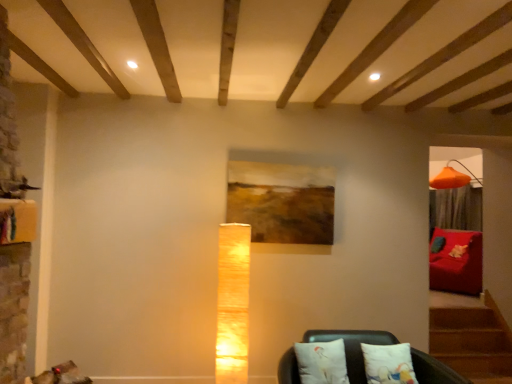
Question: From a real-world perspective, is white fabric cushions at lower center, marked as the first furniture in a front-to-back arrangement, physically below wooden painting at center?

Choices:
 (A) no
 (B) yes

Answer: (B)

Question: Is white fabric cushions at lower center, which ranks as the 2th furniture in right-to-left order, looking in the opposite direction of wooden painting at center?

Choices:
 (A) no
 (B) yes

Answer: (A)

Question: From the image's perspective, is white fabric cushions at lower center, marked as the first furniture in a front-to-back arrangement, under wooden painting at center?

Choices:
 (A) no
 (B) yes

Answer: (B)

Question: From the image's perspective, does white fabric cushions at lower center, the second furniture when ordered from back to front, appear higher than wooden painting at center?

Choices:
 (A) yes
 (B) no

Answer: (B)

Question: Does white fabric cushions at lower center, which is the first furniture in left-to-right order, have a greater width compared to wooden painting at center?

Choices:
 (A) no
 (B) yes

Answer: (B)

Question: From the image's perspective, is wooden painting at center located above or below white cotton pillow at lower center, the 2th pillow from the left?

Choices:
 (A) below
 (B) above

Answer: (B)

Question: From a real-world perspective, is wooden painting at center physically located above or below white cotton pillow at lower center, the 2th pillow from the left?

Choices:
 (A) above
 (B) below

Answer: (A)

Question: Which is correct: wooden painting at center is inside white cotton pillow at lower center, the 2th pillow from the left, or outside of it?

Choices:
 (A) inside
 (B) outside

Answer: (B)

Question: Is wooden painting at center wider or thinner than white cotton pillow at lower center, the first pillow when ordered from right to left?

Choices:
 (A) thin
 (B) wide

Answer: (A)

Question: In the image, is wooden painting at center on the left side or the right side of white fabric pillow at lower center, positioned as the first pillow in left-to-right order?

Choices:
 (A) left
 (B) right

Answer: (A)

Question: Do you think wooden painting at center is within white fabric pillow at lower center, positioned as the first pillow in left-to-right order, or outside of it?

Choices:
 (A) inside
 (B) outside

Answer: (B)

Question: Does point (263, 190) appear closer or farther from the camera than point (309, 347)?

Choices:
 (A) closer
 (B) farther

Answer: (B)

Question: Looking at their shapes, would you say wooden painting at center is wider or thinner than white fabric pillow at lower center, which is the second pillow in right-to-left order?

Choices:
 (A) thin
 (B) wide

Answer: (A)

Question: Is white cotton pillow at lower center, the first pillow when ordered from right to left, bigger or smaller than velvet red sofa at right, which is counted as the first furniture, starting from the right?

Choices:
 (A) small
 (B) big

Answer: (A)

Question: From a real-world perspective, is white cotton pillow at lower center, the first pillow when ordered from right to left, positioned above or below velvet red sofa at right, which ranks as the first furniture in back-to-front order?

Choices:
 (A) above
 (B) below

Answer: (B)